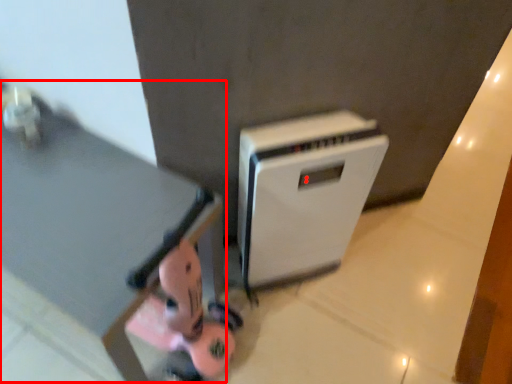
Question: From the image's perspective, what is the correct spatial positioning of table (annotated by the red box) in reference to home appliance?

Choices:
 (A) above
 (B) below

Answer: (B)